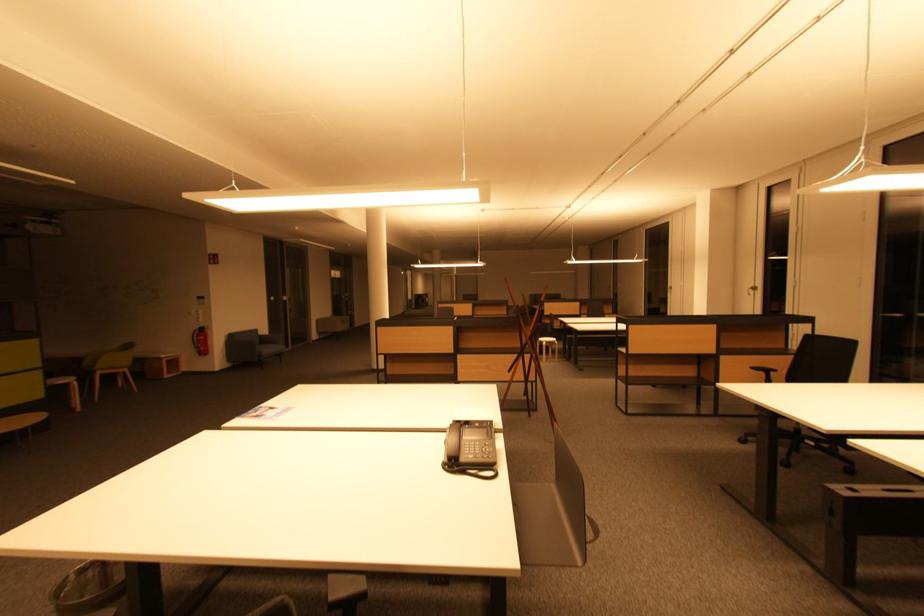
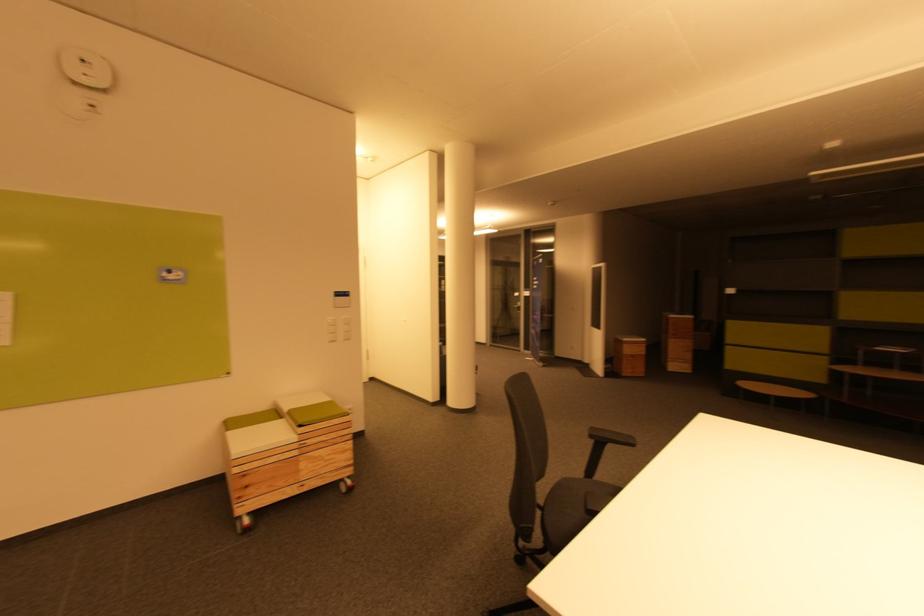
Question: I am providing you with two images of the same scene from different viewpoints. Which of the following objects are not visible in image2?

Choices:
 (A) green seat cushion
 (B) wire mesh wastebasket
 (C) white light switch
 (D) purple machine lid

Answer: (B)